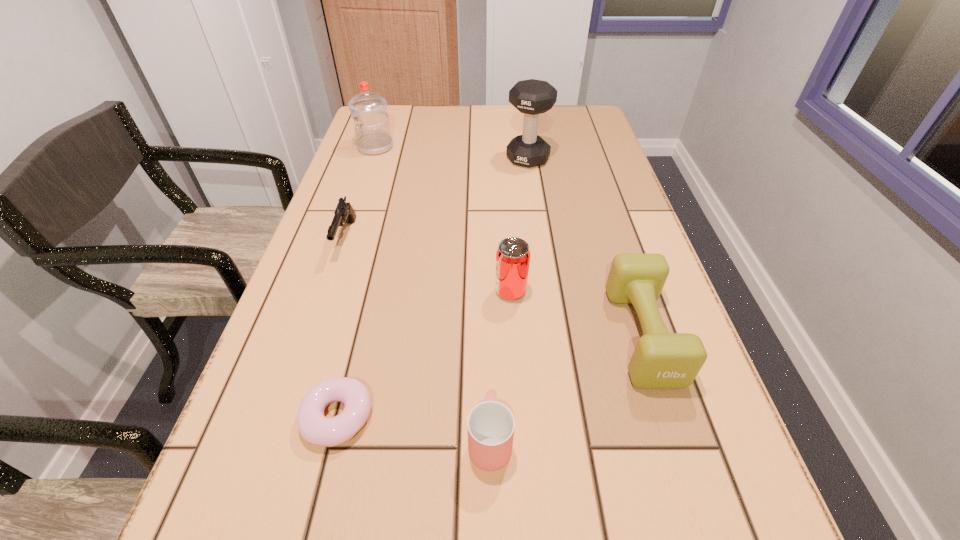
Find the location of a particular element. The width and height of the screenshot is (960, 540). vacant space situated on the left of the soda can is located at coordinates (450, 292).

What are the coordinates of `free space located 0.360m on the left of the rightmost object` in the screenshot? It's located at (422, 335).

Image resolution: width=960 pixels, height=540 pixels. In order to click on vacant space situated at the end of the barrel of the fifth nearest object in this screenshot , I will do `click(284, 424)`.

Image resolution: width=960 pixels, height=540 pixels. Identify the location of free spot located on the side of the cup with the handle. (489, 332).

This screenshot has height=540, width=960. I want to click on vacant point located on the side of the cup with the handle, so click(x=488, y=328).

What are the coordinates of `free region located 0.150m on the side of the cup with the handle` in the screenshot? It's located at (489, 336).

Find the location of a particular element. vacant point located on the back of the doughnut is located at coordinates (364, 310).

Locate an element on the screen. object present at the far edge is located at coordinates (373, 136).

I want to click on water bottle present at the left edge, so click(x=373, y=136).

What are the coordinates of `gun that is at the left edge` in the screenshot? It's located at (344, 213).